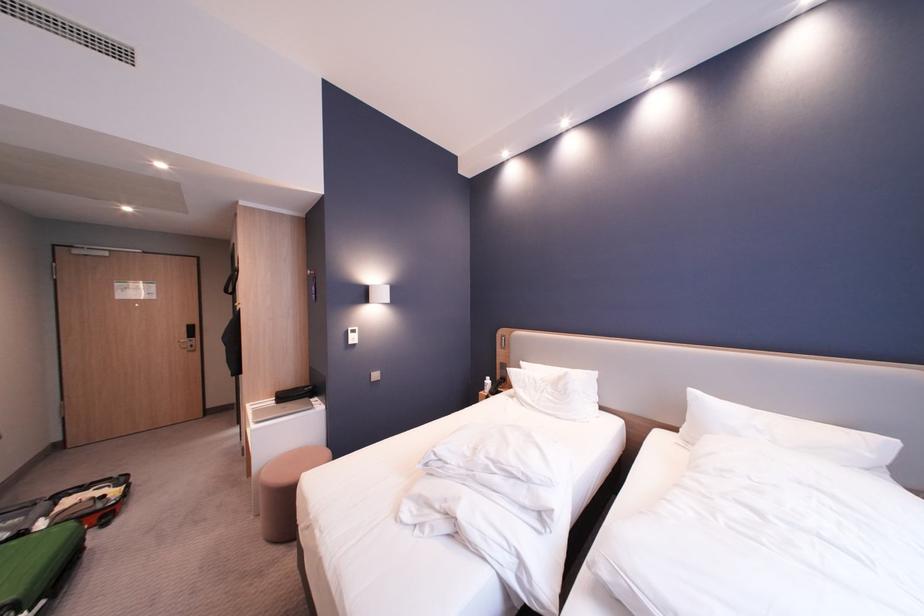
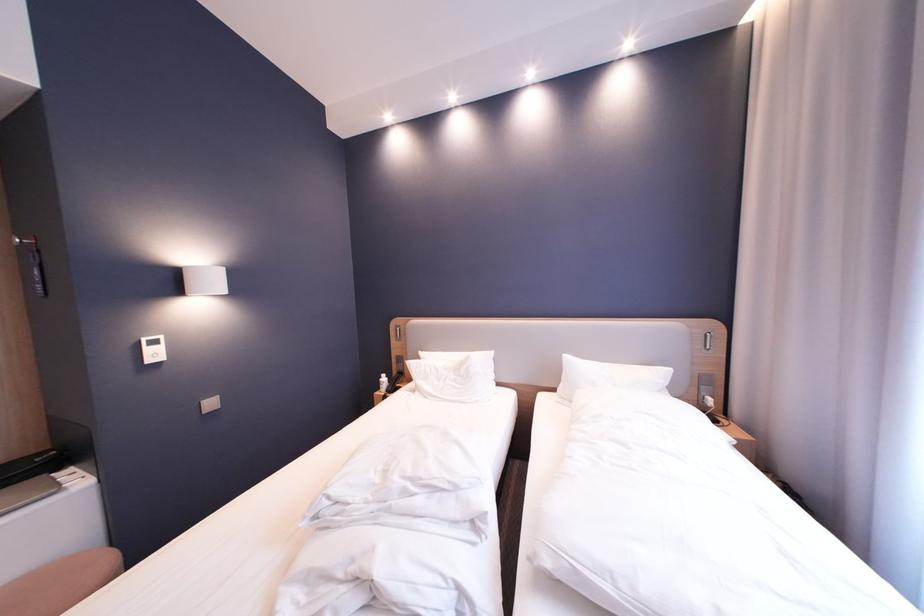
Find the pixel in the second image that matches [687,430] in the first image.

(565, 391)